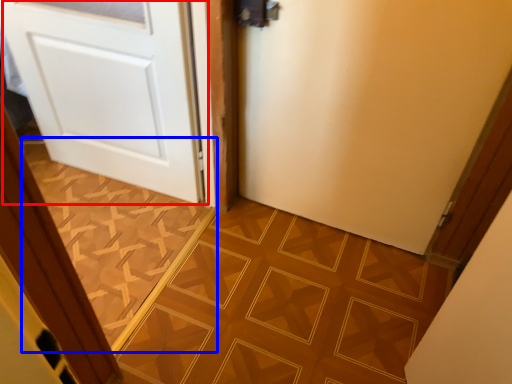
Question: Which point is further to the camera, door (highlighted by a red box) or ceramic tile (highlighted by a blue box)?

Choices:
 (A) door
 (B) ceramic tile

Answer: (B)